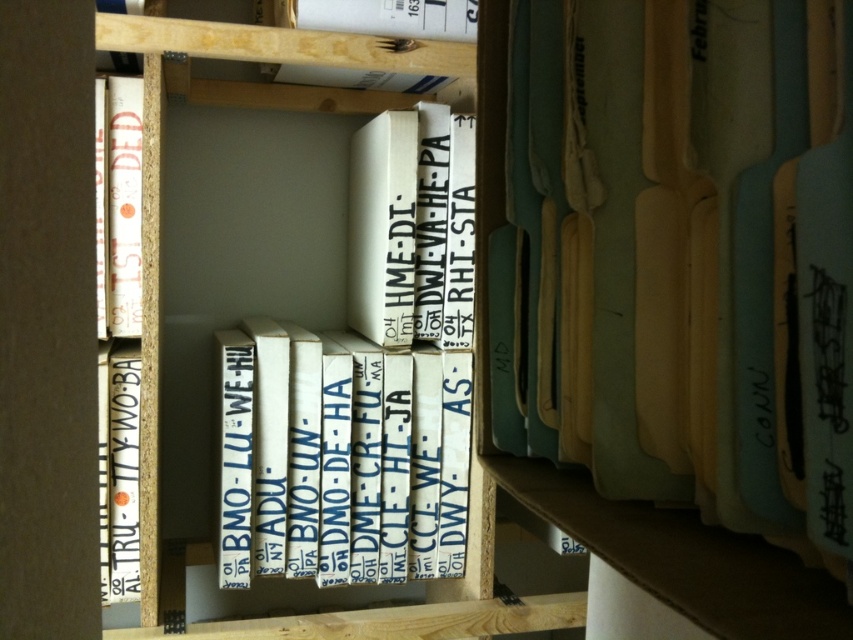
Who is taller, white cardboard boxes at center or white cardboard box at center?

white cardboard boxes at center

From the picture: Can you confirm if white cardboard boxes at center is wider than white cardboard box at center?

Correct, the width of white cardboard boxes at center exceeds that of white cardboard box at center.

Describe the element at coordinates (341, 458) in the screenshot. Image resolution: width=853 pixels, height=640 pixels. I see `white cardboard boxes at center` at that location.

Locate an element on the screen. white cardboard boxes at center is located at coordinates (341, 458).

Is white cardboard box at center closer to camera compared to white cardboard book at center?

No.

Who is lower down, white cardboard box at center or white cardboard book at center?

Positioned lower is white cardboard book at center.

The width and height of the screenshot is (853, 640). I want to click on white cardboard box at center, so click(x=413, y=227).

Where is `white cardboard box at center`? white cardboard box at center is located at coordinates (413, 227).

Does light blue cardboard box at center lie in front of white cardboard book at center?

Yes, it is in front of white cardboard book at center.

Between light blue cardboard box at center and white cardboard book at center, which one is positioned lower?

white cardboard book at center is below.

Which is behind, point (732, 177) or point (106, 380)?

The point (106, 380) is behind.

The width and height of the screenshot is (853, 640). In order to click on light blue cardboard box at center in this screenshot , I will do `click(682, 220)`.